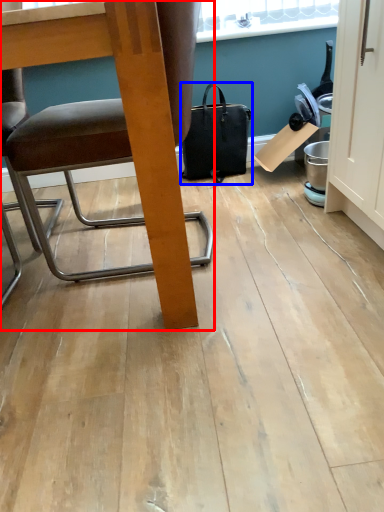
Question: Which object is further to the camera taking this photo, chair (highlighted by a red box) or handbag (highlighted by a blue box)?

Choices:
 (A) chair
 (B) handbag

Answer: (B)